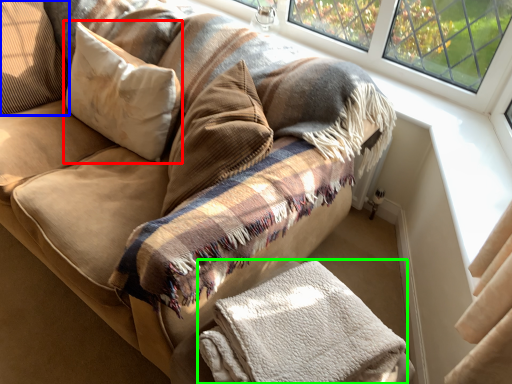
Question: Based on their relative distances, which object is nearer to pillow (highlighted by a red box)? Choose from pillow (highlighted by a blue box) and material (highlighted by a green box).

Choices:
 (A) pillow
 (B) material

Answer: (A)